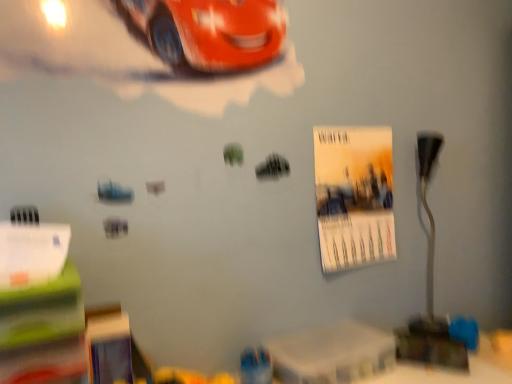
What is the approximate width of metallic silver table lamp at right?

metallic silver table lamp at right is 4.07 inches in width.

Describe the element at coordinates (430, 233) in the screenshot. Image resolution: width=512 pixels, height=384 pixels. I see `metallic silver table lamp at right` at that location.

The height and width of the screenshot is (384, 512). Describe the element at coordinates (354, 195) in the screenshot. I see `matte paper poster at center right` at that location.

Find the location of a particular element. The image size is (512, 384). white plastic table at lower center is located at coordinates (332, 354).

Is matte paper poster at center right spatially inside metallic silver table lamp at right, or outside of it?

matte paper poster at center right exists outside the volume of metallic silver table lamp at right.

Is matte paper poster at center right thinner than metallic silver table lamp at right?

Correct, the width of matte paper poster at center right is less than that of metallic silver table lamp at right.

I want to click on table lamp directly beneath the matte paper poster at center right (from a real-world perspective), so [430, 233].

Is matte paper poster at center right looking in the opposite direction of metallic silver table lamp at right?

No, metallic silver table lamp at right is not at the back of matte paper poster at center right.

Is white plastic table at lower center inside the boundaries of metallic silver table lamp at right, or outside?

white plastic table at lower center is spatially situated outside metallic silver table lamp at right.

From a real-world perspective, is white plastic table at lower center below metallic silver table lamp at right?

Yes, from a real-world perspective, white plastic table at lower center is below metallic silver table lamp at right.

Which object is thinner, white plastic table at lower center or metallic silver table lamp at right?

Thinner between the two is metallic silver table lamp at right.

Considering the points (273, 362) and (429, 168), which point is in front, point (273, 362) or point (429, 168)?

The point (273, 362) is closer to the camera.

From the image's perspective, is metallic silver table lamp at right above or below matte paper poster at center right?

Based on their image positions, metallic silver table lamp at right is located beneath matte paper poster at center right.

Consider the image. Is matte paper poster at center right inside metallic silver table lamp at right?

Actually, matte paper poster at center right is outside metallic silver table lamp at right.

Is metallic silver table lamp at right oriented towards matte paper poster at center right?

No, metallic silver table lamp at right does not turn towards matte paper poster at center right.

Is metallic silver table lamp at right to the right of matte paper poster at center right from the viewer's perspective?

Yes.

Can you confirm if white plastic table at lower center is positioned to the right of matte paper poster at center right?

Incorrect, white plastic table at lower center is not on the right side of matte paper poster at center right.

Is white plastic table at lower center thinner than matte paper poster at center right?

In fact, white plastic table at lower center might be wider than matte paper poster at center right.

Is white plastic table at lower center turned away from matte paper poster at center right?

No, white plastic table at lower center's orientation is not away from matte paper poster at center right.

From the image's perspective, does metallic silver table lamp at right appear higher than white plastic table at lower center?

Yes, from the image's perspective, metallic silver table lamp at right is over white plastic table at lower center.

How much distance is there between metallic silver table lamp at right and white plastic table at lower center?

A distance of 15.63 inches exists between metallic silver table lamp at right and white plastic table at lower center.

Is metallic silver table lamp at right spatially inside white plastic table at lower center, or outside of it?

metallic silver table lamp at right is located beyond the bounds of white plastic table at lower center.

Considering the sizes of objects metallic silver table lamp at right and white plastic table at lower center in the image provided, who is shorter, metallic silver table lamp at right or white plastic table at lower center?

white plastic table at lower center.

Considering the positions of point (370, 221) and point (330, 335), is point (370, 221) closer or farther from the camera than point (330, 335)?

Point (370, 221).

Who is bigger, matte paper poster at center right or white plastic table at lower center?

Bigger between the two is matte paper poster at center right.

Based on the photo, is matte paper poster at center right positioned with its back to white plastic table at lower center?

matte paper poster at center right is not turned away from white plastic table at lower center.

Based on the photo, is matte paper poster at center right next to white plastic table at lower center and touching it?

There is a gap between matte paper poster at center right and white plastic table at lower center.

In the image, there is a matte paper poster at center right. Where is `table lamp below it (from the image's perspective)`? Image resolution: width=512 pixels, height=384 pixels. table lamp below it (from the image's perspective) is located at coordinates (430, 233).

Identify the location of table located underneath the metallic silver table lamp at right (from a real-world perspective). [332, 354].

Considering their positions, is metallic silver table lamp at right positioned further to white plastic table at lower center than matte paper poster at center right?

metallic silver table lamp at right.

Looking at this image, based on their spatial positions, is matte paper poster at center right or metallic silver table lamp at right closer to white plastic table at lower center?

matte paper poster at center right lies closer to white plastic table at lower center than the other object.

Considering their positions, is white plastic table at lower center positioned further to matte paper poster at center right than metallic silver table lamp at right?

The object further to matte paper poster at center right is white plastic table at lower center.

Considering their positions, is matte paper poster at center right positioned closer to metallic silver table lamp at right than white plastic table at lower center?

matte paper poster at center right lies closer to metallic silver table lamp at right than the other object.

Considering their positions, is white plastic table at lower center positioned further to metallic silver table lamp at right than matte paper poster at center right?

Among the two, white plastic table at lower center is located further to metallic silver table lamp at right.

From the image, which object appears to be nearer to matte paper poster at center right, metallic silver table lamp at right or white plastic table at lower center?

Based on the image, metallic silver table lamp at right appears to be nearer to matte paper poster at center right.

Locate an element on the screen. table lamp that lies between matte paper poster at center right and white plastic table at lower center from top to bottom is located at coordinates (430, 233).